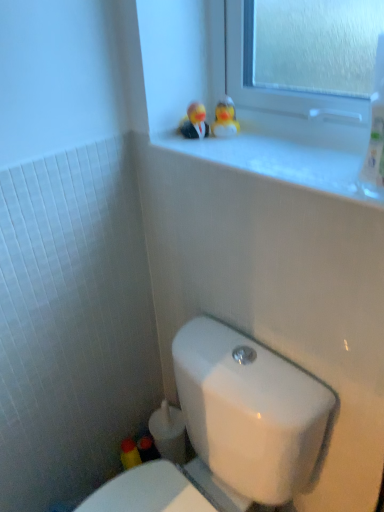
This screenshot has width=384, height=512. What are the coordinates of `free space above white glossy window sill at upper center (from a real-world perspective)` in the screenshot? It's located at (286, 154).